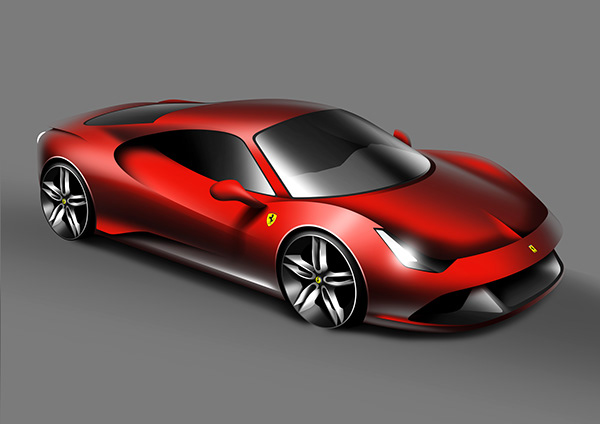
Identify the location of right door. The height and width of the screenshot is (424, 600). (183, 188).